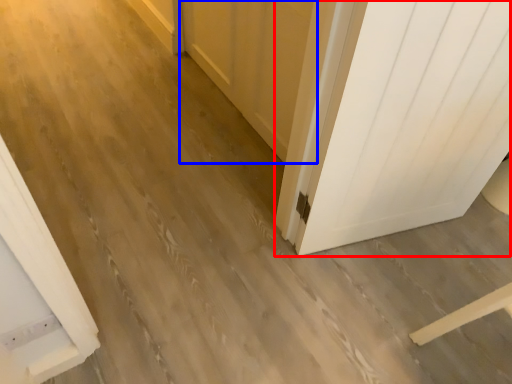
Question: Which object appears farthest to the camera in this image, door (highlighted by a red box) or barn door (highlighted by a blue box)?

Choices:
 (A) door
 (B) barn door

Answer: (B)